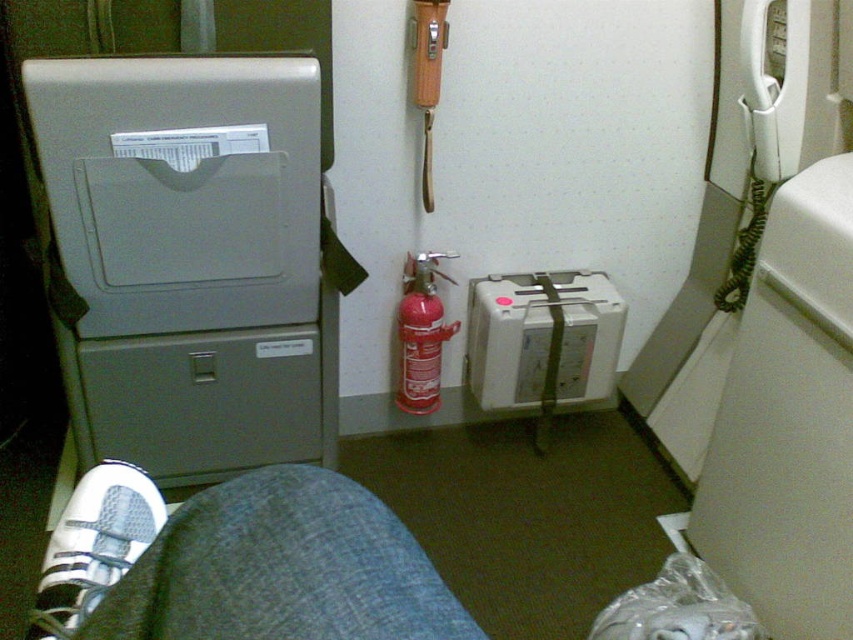
Question: Is white plastic toilet at right closer to camera compared to red matte fire extinguisher at center?

Choices:
 (A) yes
 (B) no

Answer: (A)

Question: Which object is the closest to the white plastic toilet at right?

Choices:
 (A) red matte fire extinguisher at center
 (B) matte gray tray at upper left
 (C) white mesh shoe at lower left
 (D) white plastic box at center

Answer: (D)

Question: In this image, where is white mesh shoe at lower left located relative to red matte fire extinguisher at center?

Choices:
 (A) right
 (B) left

Answer: (B)

Question: Can you confirm if white plastic box at center is positioned to the right of white mesh shoe at lower left?

Choices:
 (A) yes
 (B) no

Answer: (A)

Question: Estimate the real-world distances between objects in this image. Which object is farther from the white mesh shoe at lower left?

Choices:
 (A) white plastic toilet at right
 (B) white plastic box at center
 (C) matte gray tray at upper left
 (D) red matte fire extinguisher at center

Answer: (B)

Question: Estimate the real-world distances between objects in this image. Which object is closer to the white plastic box at center?

Choices:
 (A) red matte fire extinguisher at center
 (B) matte gray tray at upper left

Answer: (A)